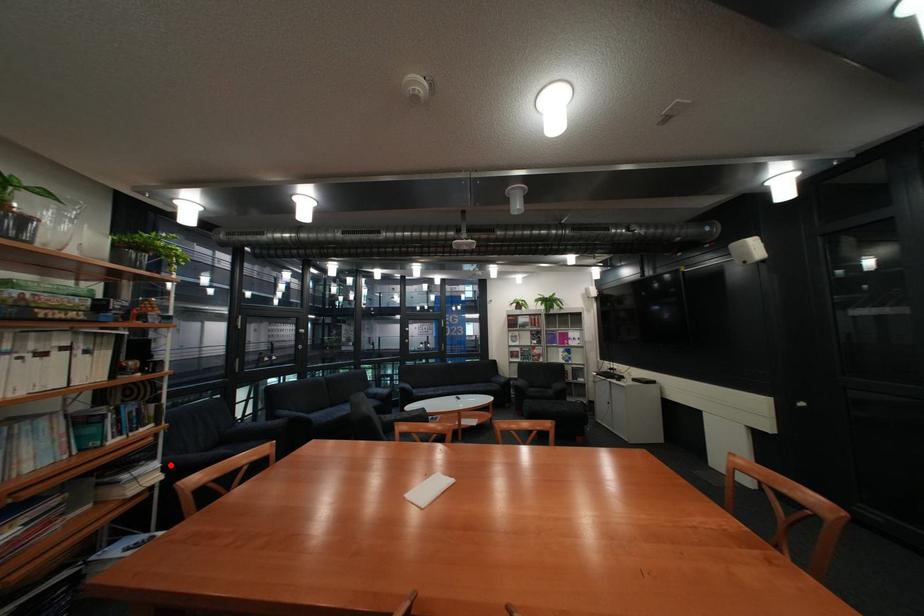
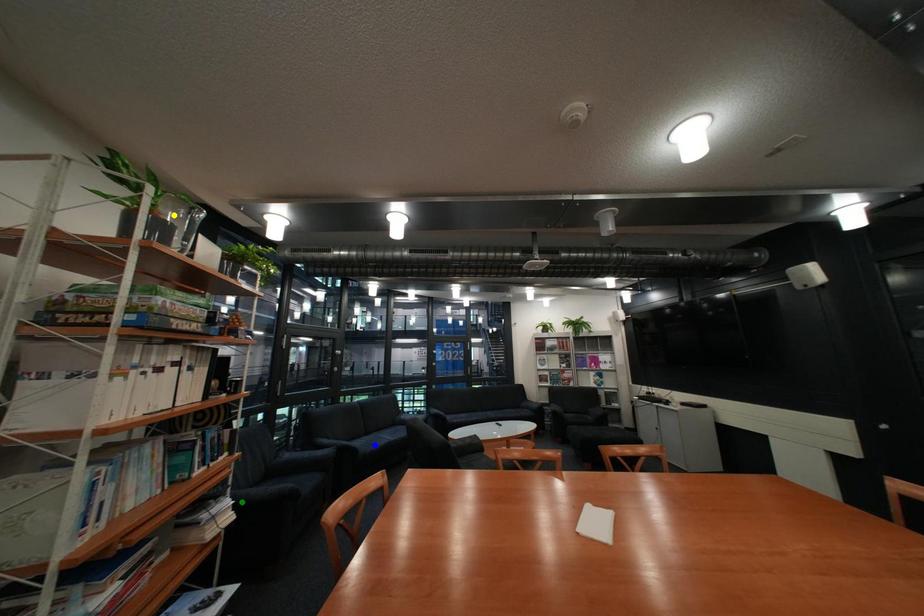
Question: I am providing you with two images of the same scene from different viewpoints. A red point is marked on the first image. You are given multiple points on the second image. Which point in image 2 is actually the same real-world point as the red point in image 1?

Choices:
 (A) blue point
 (B) yellow point
 (C) green point

Answer: (C)